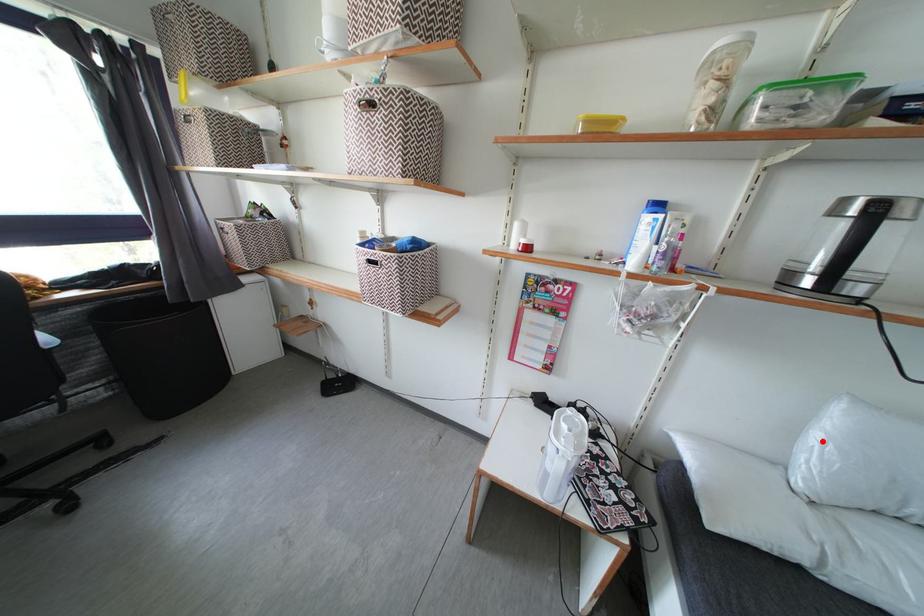
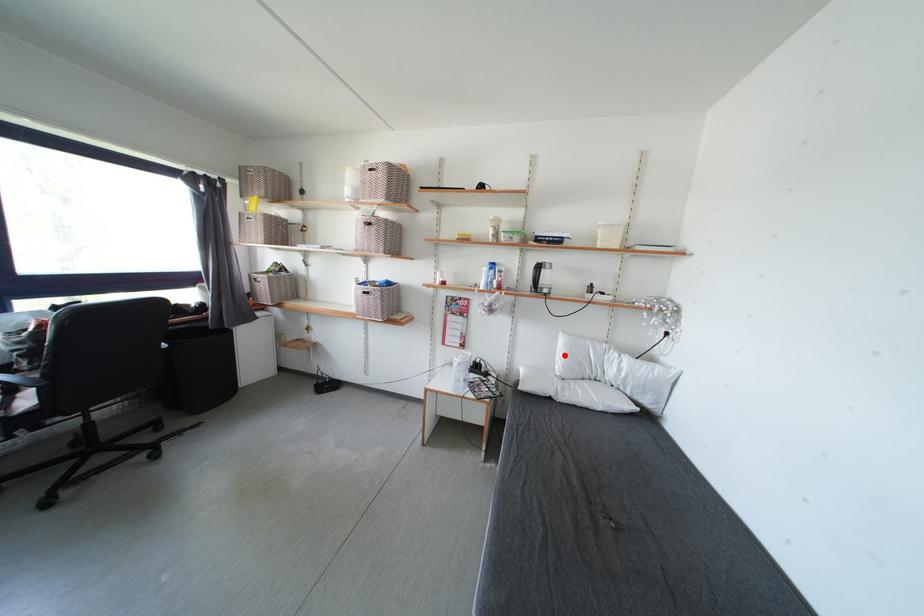
I am providing you with two images of the same scene from different viewpoints. A red point is marked on the first image and another point is marked on the second image. Do the highlighted points in image1 and image2 indicate the same real-world spot?

Yes